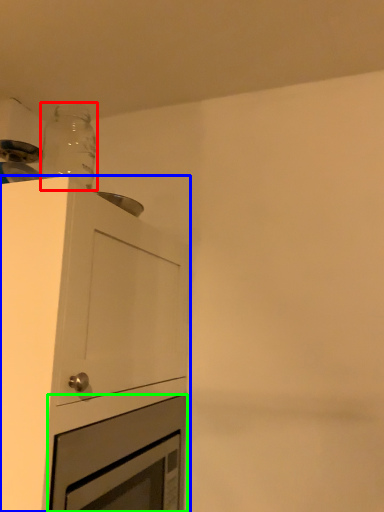
Question: Which object is positioned farthest from bottle (highlighted by a red box)? Select from cabinetry (highlighted by a blue box) and oven (highlighted by a green box).

Choices:
 (A) cabinetry
 (B) oven

Answer: (B)